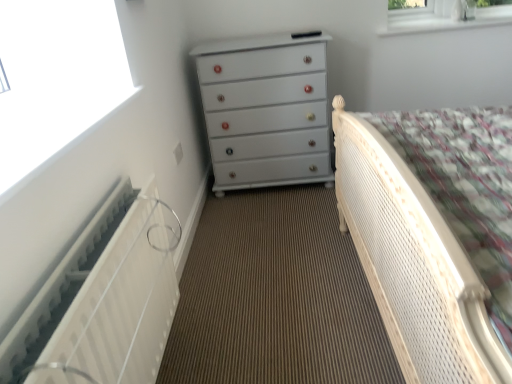
Question: Is white textured radiator at left not within white glossy radiator at left?

Choices:
 (A) no
 (B) yes

Answer: (B)

Question: Considering the relative sizes of white textured radiator at left and white glossy radiator at left in the image provided, is white textured radiator at left bigger than white glossy radiator at left?

Choices:
 (A) yes
 (B) no

Answer: (A)

Question: Is white textured radiator at left behind white glossy radiator at left?

Choices:
 (A) yes
 (B) no

Answer: (B)

Question: From the image's perspective, would you say white textured radiator at left is positioned over white glossy radiator at left?

Choices:
 (A) no
 (B) yes

Answer: (A)

Question: Would you consider white textured radiator at left to be distant from white glossy radiator at left?

Choices:
 (A) yes
 (B) no

Answer: (B)

Question: Does point (31, 39) appear closer or farther from the camera than point (126, 294)?

Choices:
 (A) closer
 (B) farther

Answer: (B)

Question: Choose the correct answer: Is white glossy radiator at left inside white textured radiator at left or outside it?

Choices:
 (A) inside
 (B) outside

Answer: (B)

Question: Looking at their shapes, would you say white glossy radiator at left is wider or thinner than white textured radiator at left?

Choices:
 (A) wide
 (B) thin

Answer: (A)

Question: Based on their positions, is white glossy radiator at left located to the left or right of white textured radiator at left?

Choices:
 (A) right
 (B) left

Answer: (B)

Question: Based on their positions, is white glossy radiator at left located to the left or right of white glossy chest of drawers at center?

Choices:
 (A) right
 (B) left

Answer: (B)

Question: Which is correct: white glossy radiator at left is inside white glossy chest of drawers at center, or outside of it?

Choices:
 (A) inside
 (B) outside

Answer: (B)

Question: Is point (0, 112) positioned closer to the camera than point (237, 185)?

Choices:
 (A) farther
 (B) closer

Answer: (B)

Question: Considering the positions of white glossy radiator at left and white glossy chest of drawers at center in the image, is white glossy radiator at left taller or shorter than white glossy chest of drawers at center?

Choices:
 (A) tall
 (B) short

Answer: (B)

Question: Considering their positions, is white glossy chest of drawers at center located in front of or behind white cane bed at right?

Choices:
 (A) front
 (B) behind

Answer: (B)

Question: From the image's perspective, is white glossy chest of drawers at center located above or below white cane bed at right?

Choices:
 (A) below
 (B) above

Answer: (B)